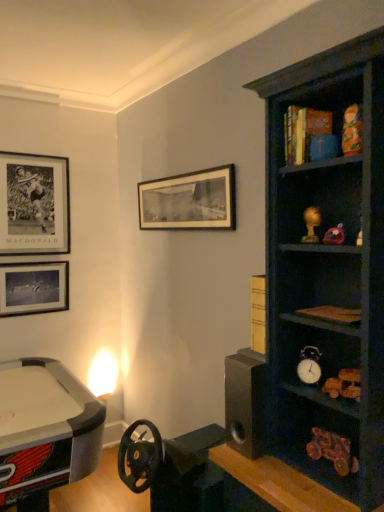
Question: From a real-world perspective, is metallic silver alarm clock at center-right above or below matte black picture frame at upper left, which is the first picture frame from left to right?

Choices:
 (A) above
 (B) below

Answer: (B)

Question: Considering the positions of point (314, 381) and point (66, 292), is point (314, 381) closer or farther from the camera than point (66, 292)?

Choices:
 (A) closer
 (B) farther

Answer: (A)

Question: Which object is positioned farthest from the black matte picture frame at upper center, positioned as the third picture frame in left-to-right order?

Choices:
 (A) matte gold figurine at upper right, placed as the 1th toy when sorted from bottom to top
 (B) matte black picture frame at upper left, which is the first picture frame from left to right
 (C) black matte picture frame at upper left, the second picture frame in the left-to-right sequence
 (D) multicolored wooden doll at upper right, which is the first toy in front-to-back order
 (E) metallic silver alarm clock at center-right

Answer: (D)

Question: Which of these objects is positioned farthest from the black matte picture frame at upper left, the 2th picture frame from the right?

Choices:
 (A) multicolored wooden doll at upper right, acting as the 2th toy starting from the bottom
 (B) matte gold figurine at upper right, the 2th toy from the top
 (C) matte black picture frame at upper left, which is the third picture frame from right to left
 (D) black matte picture frame at upper center, positioned as the third picture frame in left-to-right order
 (E) metallic silver alarm clock at center-right

Answer: (A)